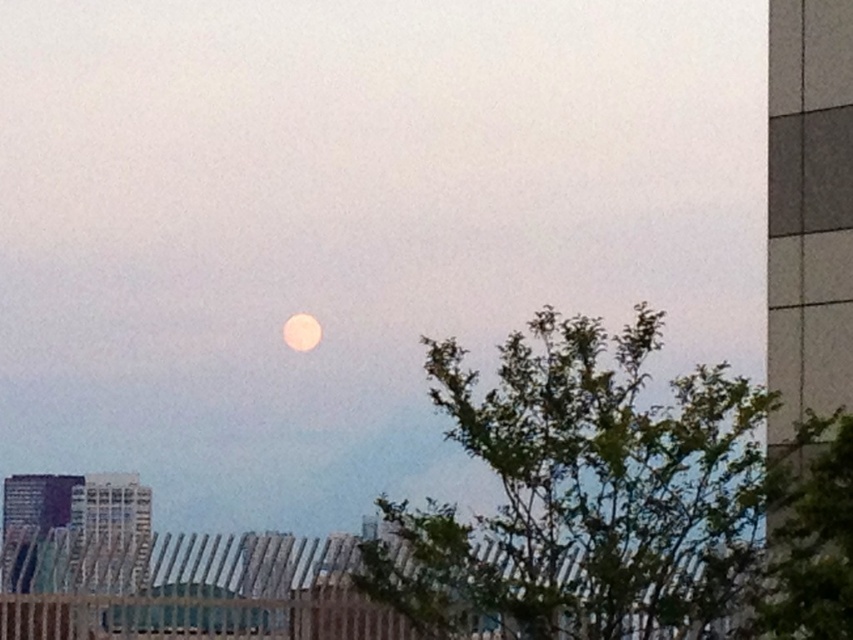
Is green leafy tree at center further to the viewer compared to smooth white moon at center?

That is False.

Does green leafy tree at center have a lesser width compared to smooth white moon at center?

No, green leafy tree at center is not thinner than smooth white moon at center.

Locate an element on the screen. Image resolution: width=853 pixels, height=640 pixels. green leafy tree at center is located at coordinates [619, 502].